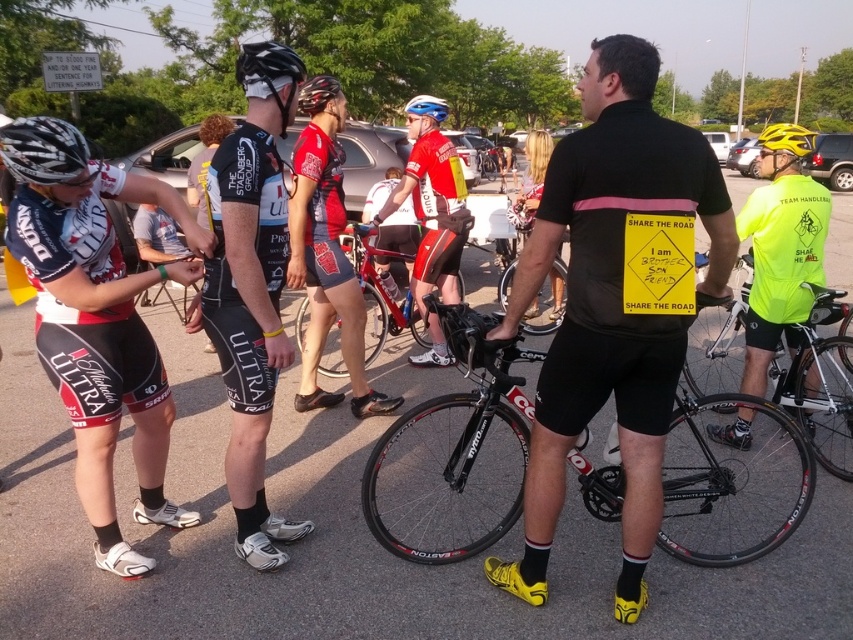
Who is taller, shiny black frame at center or blue matte helmet at upper center?

Standing taller between the two is blue matte helmet at upper center.

Can you confirm if shiny black frame at center is positioned above blue matte helmet at upper center?

Actually, shiny black frame at center is below blue matte helmet at upper center.

Is point (520, 321) positioned in front of point (431, 97)?

Yes, point (520, 321) is in front of point (431, 97).

Locate an element on the screen. Image resolution: width=853 pixels, height=640 pixels. shiny black frame at center is located at coordinates (550, 300).

Does matte black cycling jersey at left lie in front of black matte helmet at upper center?

Yes.

Which is more to the right, matte black cycling jersey at left or black matte helmet at upper center?

Positioned to the right is matte black cycling jersey at left.

This screenshot has width=853, height=640. I want to click on matte black cycling jersey at left, so click(96, 317).

Where is `matte black cycling jersey at left`? The width and height of the screenshot is (853, 640). matte black cycling jersey at left is located at coordinates (96, 317).

Which is in front, point (461, 232) or point (553, 284)?

Point (461, 232) is in front.

Locate an element on the screen. The image size is (853, 640). red/white jersey at center is located at coordinates (432, 225).

Image resolution: width=853 pixels, height=640 pixels. Identify the location of red/white jersey at center. (432, 225).